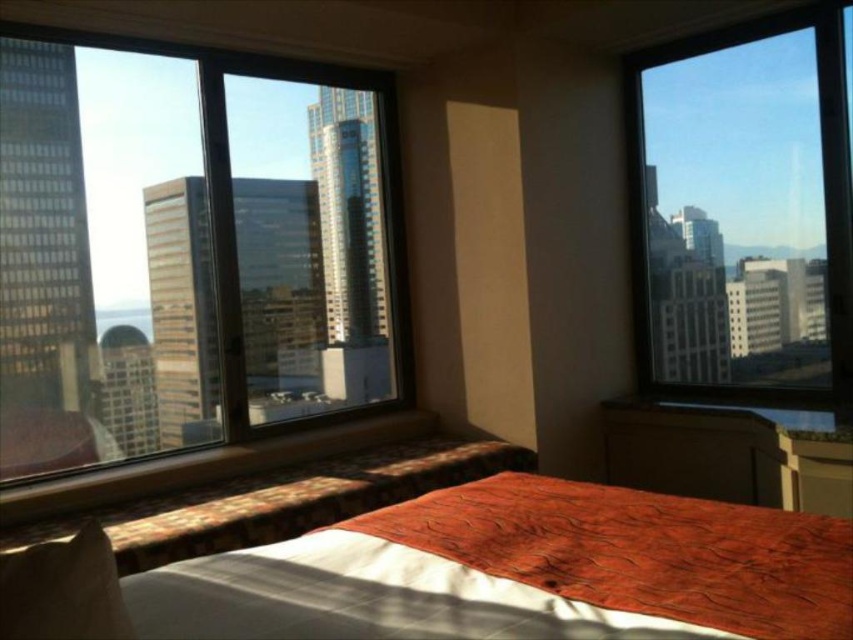
Does transparent glass window at left appear on the left side of transparent glass window at right?

Correct, you'll find transparent glass window at left to the left of transparent glass window at right.

Does point (320, 147) come in front of point (838, 312)?

That is False.

Find the location of a particular element. transparent glass window at left is located at coordinates (184, 248).

Can you confirm if textured orange bedspread at center is wider than transparent glass window at right?

Yes.

Who is more distant from viewer, (653, 596) or (654, 268)?

Point (654, 268)

You are a GUI agent. You are given a task and a screenshot of the screen. Output one action in this format:
    pyautogui.click(x=<x>, y=<y>)
    Task: Click on the textured orange bedspread at center
    This screenshot has width=853, height=640.
    Given the screenshot: What is the action you would take?
    pyautogui.click(x=521, y=572)

Locate an element on the screen. textured orange bedspread at center is located at coordinates (521, 572).

Is textured orange bedspread at center taller than white soft pillow at lower left?

In fact, textured orange bedspread at center may be shorter than white soft pillow at lower left.

Between textured orange bedspread at center and white soft pillow at lower left, which one has less height?

textured orange bedspread at center

Where is `textured orange bedspread at center`? Image resolution: width=853 pixels, height=640 pixels. textured orange bedspread at center is located at coordinates (521, 572).